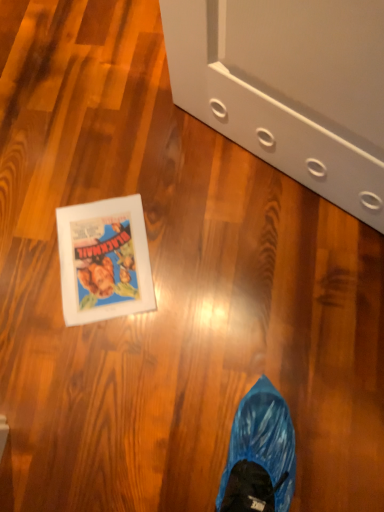
Where is `unoccupied region to the right of matte paper comic book at lower left`? unoccupied region to the right of matte paper comic book at lower left is located at coordinates (203, 249).